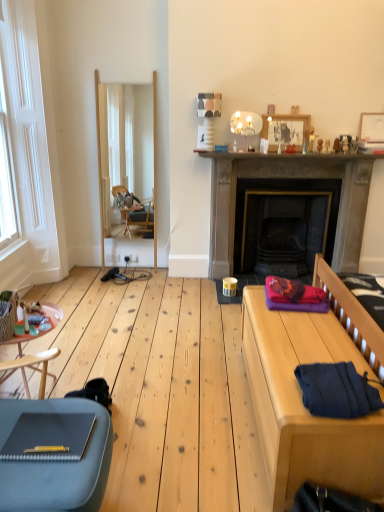
Describe the element at coordinates (286, 130) in the screenshot. I see `wooden picture frame at upper center, acting as the 2th picture frame starting from the right` at that location.

What is the approximate height of wooden picture frame at upper right, the second picture frame in the left-to-right sequence?

28.02 centimeters.

This screenshot has width=384, height=512. Describe the element at coordinates (371, 127) in the screenshot. I see `wooden picture frame at upper right, the first picture frame from the right` at that location.

Describe the element at coordinates (301, 393) in the screenshot. I see `wooden bed frame at right` at that location.

The width and height of the screenshot is (384, 512). What do you see at coordinates (127, 169) in the screenshot? I see `wooden frame mirror at center` at bounding box center [127, 169].

Find the location of `wooden frame mirror at center`. wooden frame mirror at center is located at coordinates (127, 169).

What is the approximate height of white wood window at left?

It is 5.20 feet.

Where is `wooden picture frame at upper center, the 1th picture frame when ordered from left to right`? The image size is (384, 512). wooden picture frame at upper center, the 1th picture frame when ordered from left to right is located at coordinates (286, 130).

Is white wood window at left facing towards wooden side table at lower left?

No.

From the image's perspective, which is above, white wood window at left or wooden side table at lower left?

white wood window at left is shown above in the image.

Is white wood window at left situated inside wooden side table at lower left or outside?

white wood window at left is not enclosed by wooden side table at lower left.

I want to click on window lying above the wooden side table at lower left (from the image's perspective), so click(7, 176).

Is wooden bed frame at right surrounding wooden side table at lower left?

No, wooden side table at lower left is not inside wooden bed frame at right.

Would you consider wooden bed frame at right to be distant from wooden side table at lower left?

Yes, wooden bed frame at right and wooden side table at lower left are located far from each other.

From the image's perspective, is wooden bed frame at right under wooden side table at lower left?

Yes, from the image's perspective, wooden bed frame at right is beneath wooden side table at lower left.

From a real-world perspective, is wooden bed frame at right on top of wooden side table at lower left?

No, from a real-world perspective, wooden bed frame at right is not over wooden side table at lower left

Which of these two, wooden frame mirror at center or white wood window at left, is smaller?

white wood window at left.

Does point (155, 261) come in front of point (9, 219)?

No, it is not.

Based on their positions, is wooden frame mirror at center located to the left or right of white wood window at left?

wooden frame mirror at center is to the right of white wood window at left.

Considering the relative sizes of wooden frame mirror at center and white wood window at left in the image provided, is wooden frame mirror at center taller than white wood window at left?

Correct, wooden frame mirror at center is much taller as white wood window at left.

Measure the distance between white wood window at left and wooden picture frame at upper center, acting as the 2th picture frame starting from the right.

white wood window at left is 2.28 meters from wooden picture frame at upper center, acting as the 2th picture frame starting from the right.

Does white wood window at left have a larger size compared to wooden picture frame at upper center, the 1th picture frame when ordered from left to right?

Correct, white wood window at left is larger in size than wooden picture frame at upper center, the 1th picture frame when ordered from left to right.

Between white wood window at left and wooden picture frame at upper center, acting as the 2th picture frame starting from the right, which one appears on the right side from the viewer's perspective?

wooden picture frame at upper center, acting as the 2th picture frame starting from the right.

How many degrees apart are the facing directions of white wood window at left and wooden picture frame at upper center, the 1th picture frame when ordered from left to right?

90.1 degrees separate the facing orientations of white wood window at left and wooden picture frame at upper center, the 1th picture frame when ordered from left to right.

Consider the image. Is wooden frame mirror at center facing away from wooden side table at lower left?

No, wooden frame mirror at center is not facing the opposite direction of wooden side table at lower left.

Locate an element on the screen. The height and width of the screenshot is (512, 384). mirror that appears on the right of wooden side table at lower left is located at coordinates (127, 169).

Would you say wooden frame mirror at center is outside wooden side table at lower left?

That's correct, wooden frame mirror at center is outside of wooden side table at lower left.

Is dark blue knitted sweater at lower right inside or outside of wooden frame mirror at center?

dark blue knitted sweater at lower right cannot be found inside wooden frame mirror at center.

Considering the sizes of objects dark blue knitted sweater at lower right and wooden frame mirror at center in the image provided, who is shorter, dark blue knitted sweater at lower right or wooden frame mirror at center?

With less height is dark blue knitted sweater at lower right.

Which of these two, dark blue knitted sweater at lower right or wooden frame mirror at center, is thinner?

wooden frame mirror at center is thinner.

From a real-world perspective, relative to wooden frame mirror at center, is dark blue knitted sweater at lower right vertically above or below?

From a real-world perspective, dark blue knitted sweater at lower right is physically below wooden frame mirror at center.

Based on the photo, could you tell me if wooden bed frame at right is turned towards wooden picture frame at upper center, the 1th picture frame when ordered from left to right?

No, wooden bed frame at right does not turn towards wooden picture frame at upper center, the 1th picture frame when ordered from left to right.

What's the angular difference between wooden bed frame at right and wooden picture frame at upper center, the 1th picture frame when ordered from left to right,'s facing directions?

There is a 90.2-degree angle between the facing directions of wooden bed frame at right and wooden picture frame at upper center, the 1th picture frame when ordered from left to right.

From the image's perspective, relative to wooden picture frame at upper center, the 1th picture frame when ordered from left to right, is wooden bed frame at right above or below?

wooden bed frame at right is below wooden picture frame at upper center, the 1th picture frame when ordered from left to right.

Identify the location of window lying on the left of wooden side table at lower left. (7, 176).

Identify the location of bed frame lying in front of the wooden side table at lower left. The image size is (384, 512). click(x=301, y=393).

Looking at the image, which one is located further to wooden picture frame at upper center, acting as the 2th picture frame starting from the right, dark blue knitted sweater at lower right or wooden bed frame at right?

dark blue knitted sweater at lower right is further to wooden picture frame at upper center, acting as the 2th picture frame starting from the right.

When comparing their distances from wooden side table at lower left, does wooden frame mirror at center or wooden bed frame at right seem further?

Based on the image, wooden frame mirror at center appears to be further to wooden side table at lower left.

Considering their positions, is wooden bed frame at right positioned further to stone fireplace mantel at center than wooden side table at lower left?

wooden side table at lower left is further to stone fireplace mantel at center.

Considering their positions, is stone fireplace mantel at center positioned further to dark gray stone fireplace at center than white wood window at left?

white wood window at left lies further to dark gray stone fireplace at center than the other object.

Which object lies further to the anchor point white wood window at left, dark gray stone fireplace at center or wooden bed frame at right?

wooden bed frame at right is further to white wood window at left.

Looking at the image, which one is located closer to dark blue knitted sweater at lower right, wooden side table at lower left or wooden bed frame at right?

Based on the image, wooden bed frame at right appears to be nearer to dark blue knitted sweater at lower right.

Based on the photo, from the image, which object appears to be nearer to wooden picture frame at upper center, the 1th picture frame when ordered from left to right, wooden bed frame at right or white wood window at left?

The object closer to wooden picture frame at upper center, the 1th picture frame when ordered from left to right, is wooden bed frame at right.

From the image, which object appears to be nearer to stone fireplace mantel at center, dark blue knitted sweater at lower right or dark gray stone fireplace at center?

Among the two, dark gray stone fireplace at center is located nearer to stone fireplace mantel at center.

At what (x,y) coordinates should I click in order to perform the action: click on mirror located between white wood window at left and dark gray stone fireplace at center in the left-right direction. Please return your answer as a coordinate pair (x, y). Looking at the image, I should click on (127, 169).

This screenshot has width=384, height=512. Identify the location of mantle located between wooden picture frame at upper center, the 1th picture frame when ordered from left to right, and wooden picture frame at upper right, the second picture frame in the left-to-right sequence, in the left-right direction. (288, 156).

Find the location of a particular element. side table between wooden bed frame at right and stone fireplace mantel at center from front to back is located at coordinates (29, 365).

The height and width of the screenshot is (512, 384). What are the coordinates of `mantle located between wooden bed frame at right and wooden picture frame at upper center, the 1th picture frame when ordered from left to right, in the depth direction` in the screenshot? It's located at (288, 156).